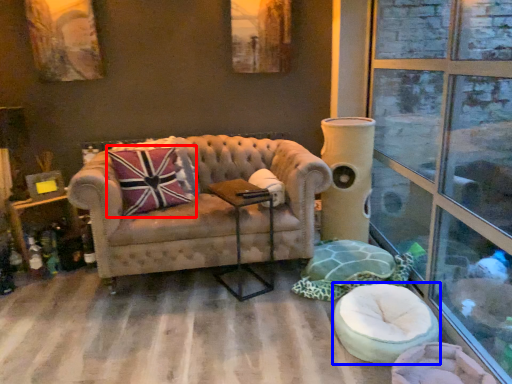
Question: Which point is closer to the camera, throw pillow (highlighted by a red box) or swivel chair (highlighted by a blue box)?

Choices:
 (A) throw pillow
 (B) swivel chair

Answer: (B)